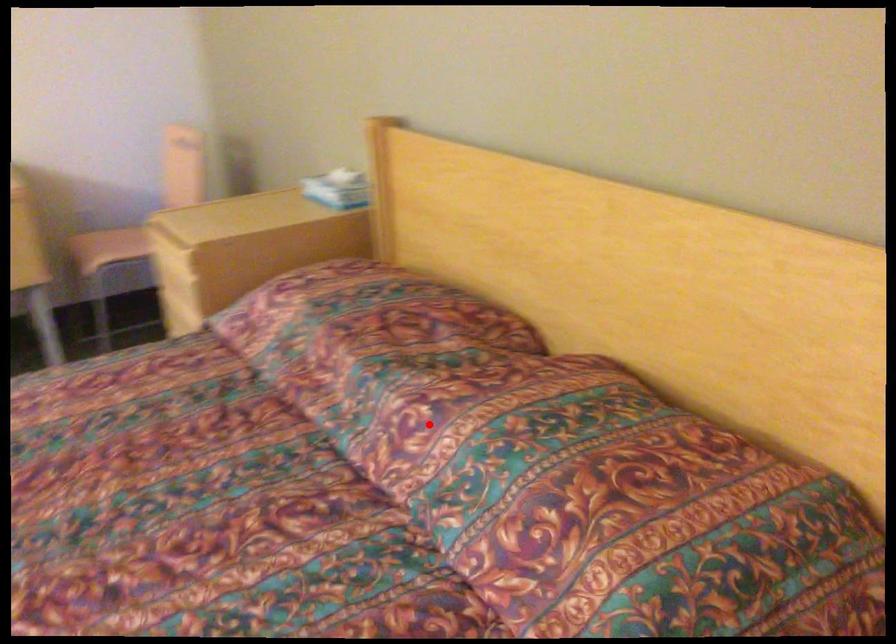
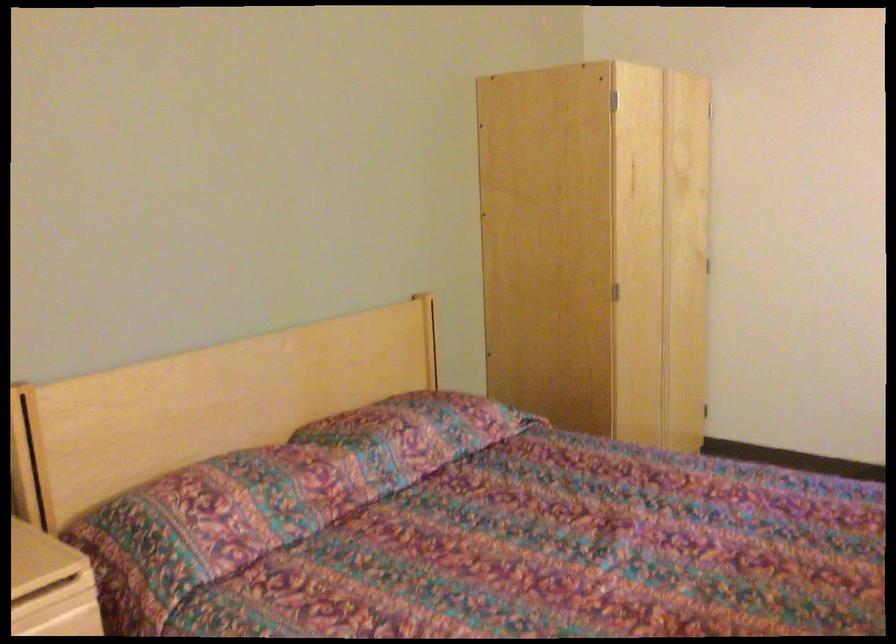
Question: I am providing you with two images of the same scene from different viewpoints. A red point is marked on the first image. Can you still see the location of the red point in image 2?

Choices:
 (A) Yes
 (B) No

Answer: (A)